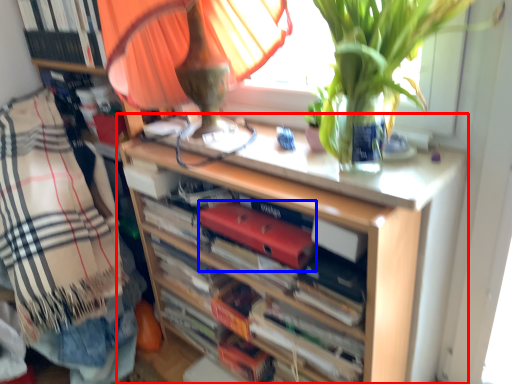
Question: Which of the following is the closest to the observer, shelf (highlighted by a red box) or paperback book (highlighted by a blue box)?

Choices:
 (A) shelf
 (B) paperback book

Answer: (A)